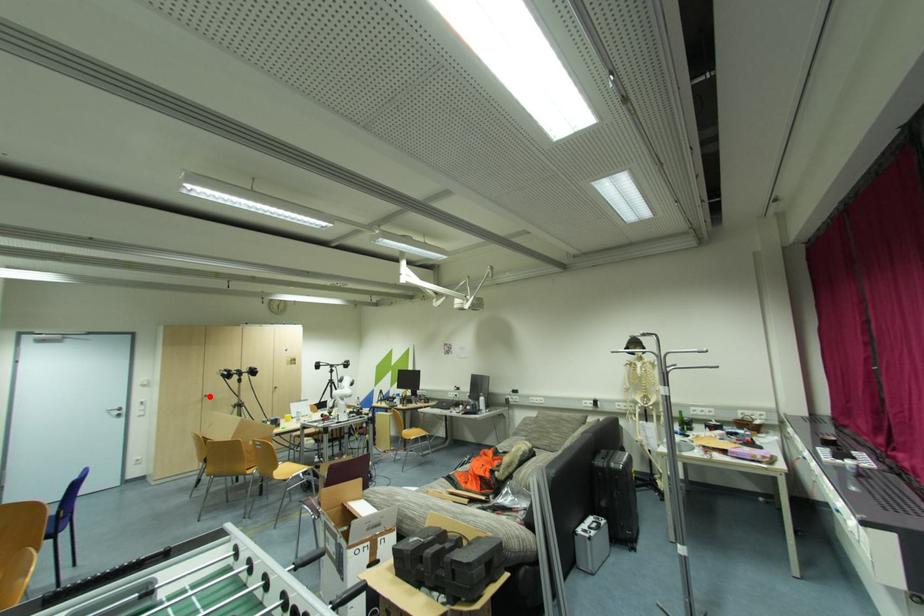
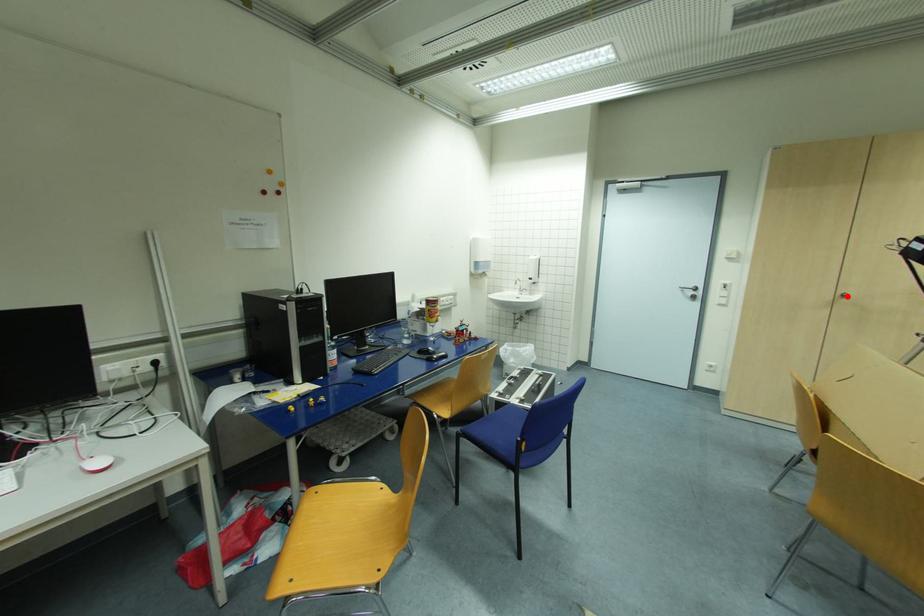
Consider the image. I am providing you with two images of the same scene from different viewpoints. A red point is marked on the first image and another point is marked on the second image. Are the points marked in image1 and image2 representing the same 3D position?

Yes